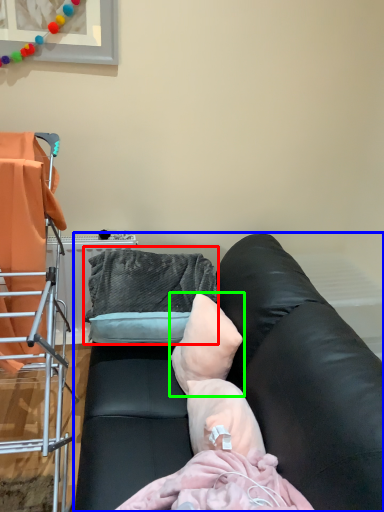
Question: Which object is positioned closest to bean bag chair (highlighted by a red box)? Select from studio couch (highlighted by a blue box) and pillow (highlighted by a green box).

Choices:
 (A) studio couch
 (B) pillow

Answer: (B)